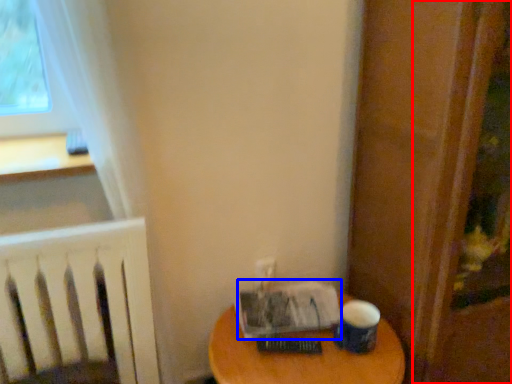
Question: Which object is further to the camera taking this photo, screen door (highlighted by a red box) or paperback book (highlighted by a blue box)?

Choices:
 (A) screen door
 (B) paperback book

Answer: (B)